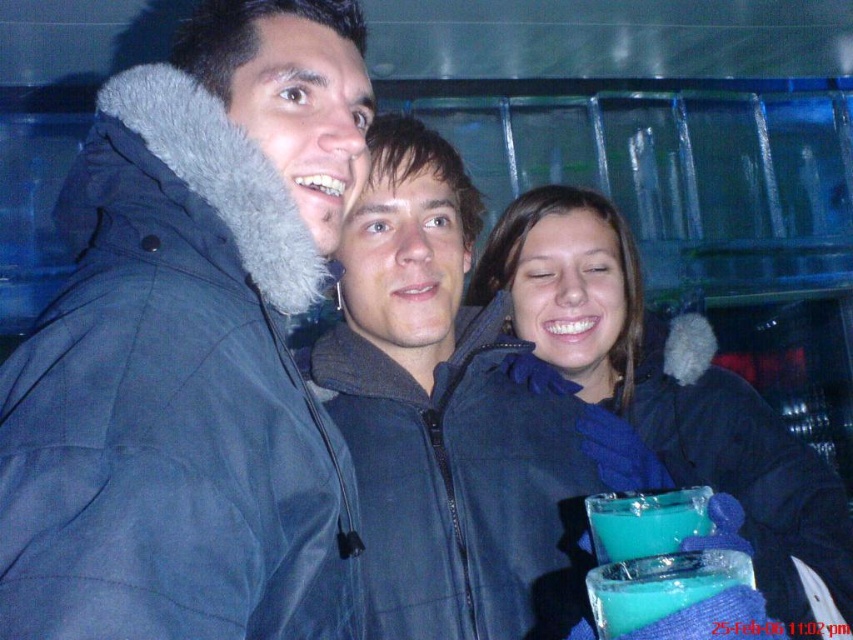
Question: Which point is farther to the camera?

Choices:
 (A) blue fleece scarf at center
 (B) dark blue puffy jacket at left

Answer: (A)

Question: Where is dark blue puffy jacket at left located in relation to blue fleece scarf at center in the image?

Choices:
 (A) above
 (B) below

Answer: (A)

Question: Does dark blue puffy jacket at left appear under blue fleece scarf at center?

Choices:
 (A) no
 (B) yes

Answer: (A)

Question: Which point appears farthest from the camera in this image?

Choices:
 (A) (498, 280)
 (B) (47, 621)

Answer: (A)

Question: Can you confirm if dark blue puffy jacket at left is positioned to the right of blue fleece scarf at center?

Choices:
 (A) yes
 (B) no

Answer: (B)